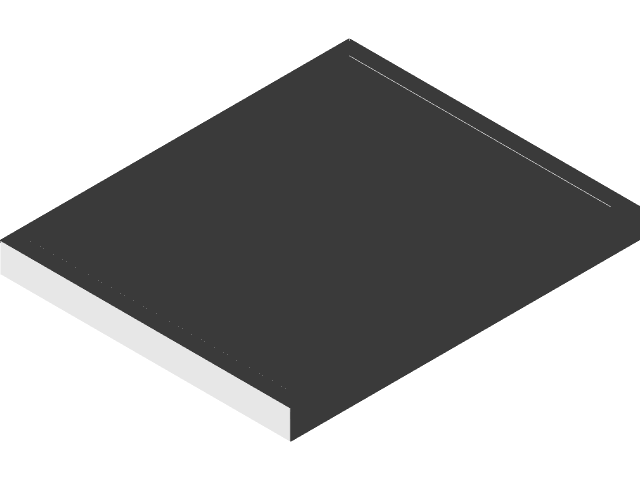
Where is `corner`? Image resolution: width=640 pixels, height=480 pixels. corner is located at coordinates (637, 205), (637, 239), (348, 39), (2, 239), (2, 271), (288, 409), (288, 439).